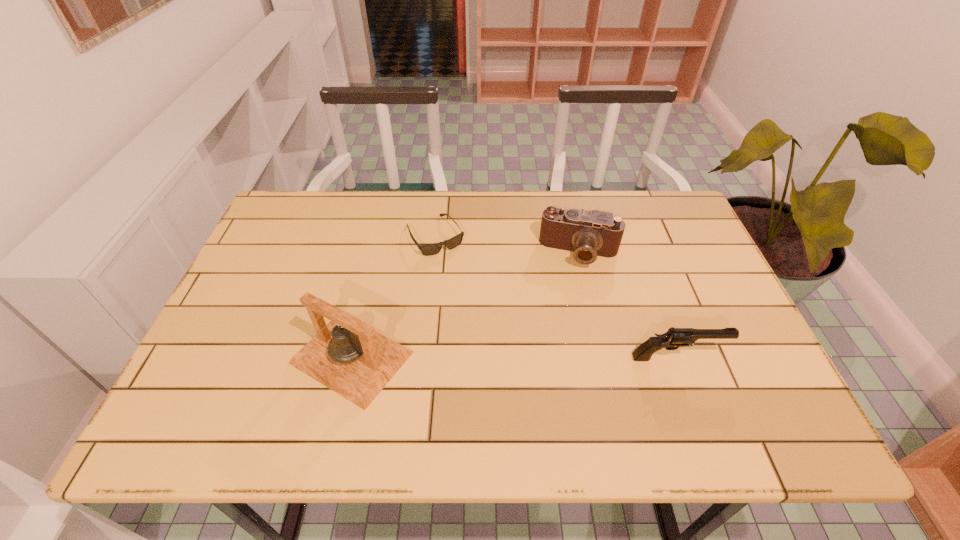
Where is `object that is the third closest to the camera`? object that is the third closest to the camera is located at coordinates (347, 355).

Point out which object is positioned as the nearest to the camera. Please provide its 2D coordinates. Your answer should be formatted as a tuple, i.e. [(x, y)], where the tuple contains the x and y coordinates of a point satisfying the conditions above.

[(430, 249)]

I want to click on free space in the image that satisfies the following two spatial constraints: 1. on the front side of the camera; 2. at the end of the barrel of the gun, so click(604, 357).

Locate an element on the screen. free region that satisfies the following two spatial constraints: 1. on the front side of the gun; 2. at the end of the barrel of the camera is located at coordinates (604, 357).